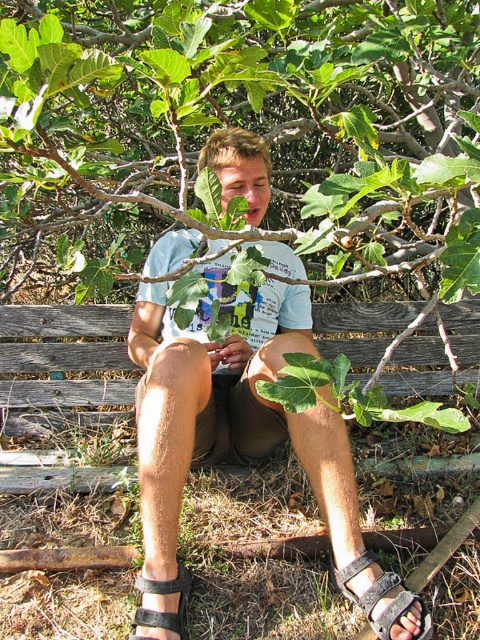
Locate an element on the screen. weathered wood park bench at lower center is located at coordinates (64, 360).

Between weathered wood park bench at lower center and black leather sandal at lower center, which one appears on the left side from the viewer's perspective?

weathered wood park bench at lower center is more to the left.

Identify the location of weathered wood park bench at lower center. (64, 360).

Where is `weathered wood park bench at lower center`? The width and height of the screenshot is (480, 640). weathered wood park bench at lower center is located at coordinates (64, 360).

Consider the image. How much distance is there between green leafy tree at center and black suede sandal at lower center?

A distance of 6.11 feet exists between green leafy tree at center and black suede sandal at lower center.

Is green leafy tree at center to the left of black suede sandal at lower center from the viewer's perspective?

Indeed, green leafy tree at center is positioned on the left side of black suede sandal at lower center.

Is point (472, 252) more distant than point (372, 560)?

No, (472, 252) is closer to viewer.

Locate an element on the screen. The image size is (480, 640). green leafy tree at center is located at coordinates (247, 124).

Which is below, green leafy tree at center or weathered wood park bench at lower center?

weathered wood park bench at lower center is below.

Based on the photo, measure the distance between point (78, 115) and camera.

2.47 meters

This screenshot has width=480, height=640. What do you see at coordinates (247, 124) in the screenshot?
I see `green leafy tree at center` at bounding box center [247, 124].

This screenshot has height=640, width=480. Identify the location of green leafy tree at center. (247, 124).